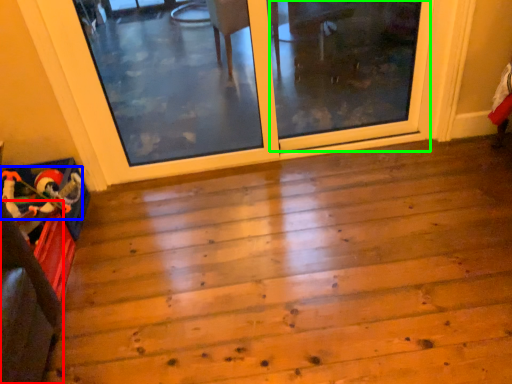
Question: Which object is positioned farthest from furniture (highlighted by a red box)? Select from toy (highlighted by a blue box) and screen door (highlighted by a green box).

Choices:
 (A) toy
 (B) screen door

Answer: (B)